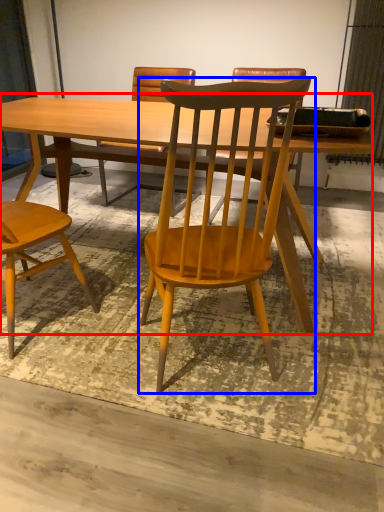
Question: Which of the following is the closest to the observer, table (highlighted by a red box) or chair (highlighted by a blue box)?

Choices:
 (A) table
 (B) chair

Answer: (B)